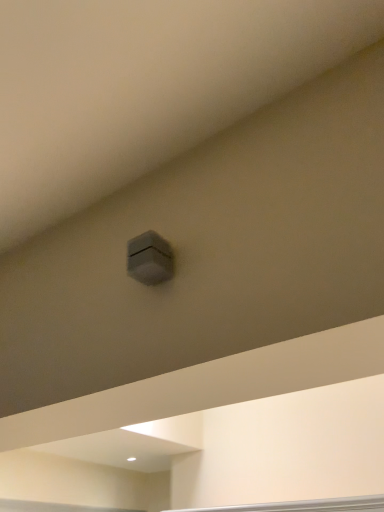
The width and height of the screenshot is (384, 512). What do you see at coordinates (150, 259) in the screenshot?
I see `satin gray cube at upper center` at bounding box center [150, 259].

At what (x,y) coordinates should I click in order to perform the action: click on satin gray cube at upper center. Please return your answer as a coordinate pair (x, y). The image size is (384, 512). Looking at the image, I should click on (150, 259).

You are a GUI agent. You are given a task and a screenshot of the screen. Output one action in this format:
    pyautogui.click(x=<x>, y=<y>)
    Task: Click on the satin gray cube at upper center
    
    Given the screenshot: What is the action you would take?
    pyautogui.click(x=150, y=259)